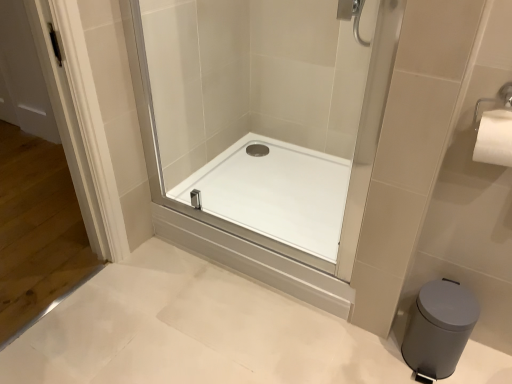
Question: Would you say gray matte trash can at lower right is outside transparent glass shower door at center?

Choices:
 (A) no
 (B) yes

Answer: (B)

Question: From the image's perspective, is gray matte trash can at lower right over transparent glass shower door at center?

Choices:
 (A) no
 (B) yes

Answer: (A)

Question: Is gray matte trash can at lower right turned away from transparent glass shower door at center?

Choices:
 (A) no
 (B) yes

Answer: (A)

Question: Is gray matte trash can at lower right touching transparent glass shower door at center?

Choices:
 (A) yes
 (B) no

Answer: (B)

Question: From the image's perspective, is gray matte trash can at lower right beneath transparent glass shower door at center?

Choices:
 (A) no
 (B) yes

Answer: (B)

Question: Is there a large distance between gray matte trash can at lower right and transparent glass shower door at center?

Choices:
 (A) yes
 (B) no

Answer: (B)

Question: Considering the relative positions of white glossy shower tray at center and gray matte trash can at lower right in the image provided, is white glossy shower tray at center behind gray matte trash can at lower right?

Choices:
 (A) yes
 (B) no

Answer: (A)

Question: Can you confirm if white glossy shower tray at center is taller than gray matte trash can at lower right?

Choices:
 (A) no
 (B) yes

Answer: (A)

Question: From the image's perspective, would you say white glossy shower tray at center is shown under gray matte trash can at lower right?

Choices:
 (A) yes
 (B) no

Answer: (B)

Question: Is white glossy shower tray at center with gray matte trash can at lower right?

Choices:
 (A) yes
 (B) no

Answer: (B)

Question: Is white glossy shower tray at center located outside gray matte trash can at lower right?

Choices:
 (A) yes
 (B) no

Answer: (A)

Question: From the image's perspective, is white glossy shower tray at center above gray matte trash can at lower right?

Choices:
 (A) yes
 (B) no

Answer: (A)

Question: Would you say transparent glass shower door at center is outside white glossy shower tray at center?

Choices:
 (A) yes
 (B) no

Answer: (A)